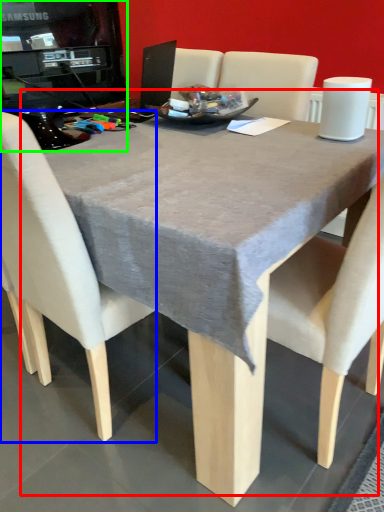
Question: Which is farther away from table (highlighted by a red box)? chair (highlighted by a blue box) or desktop computer (highlighted by a green box)?

Choices:
 (A) chair
 (B) desktop computer

Answer: (B)